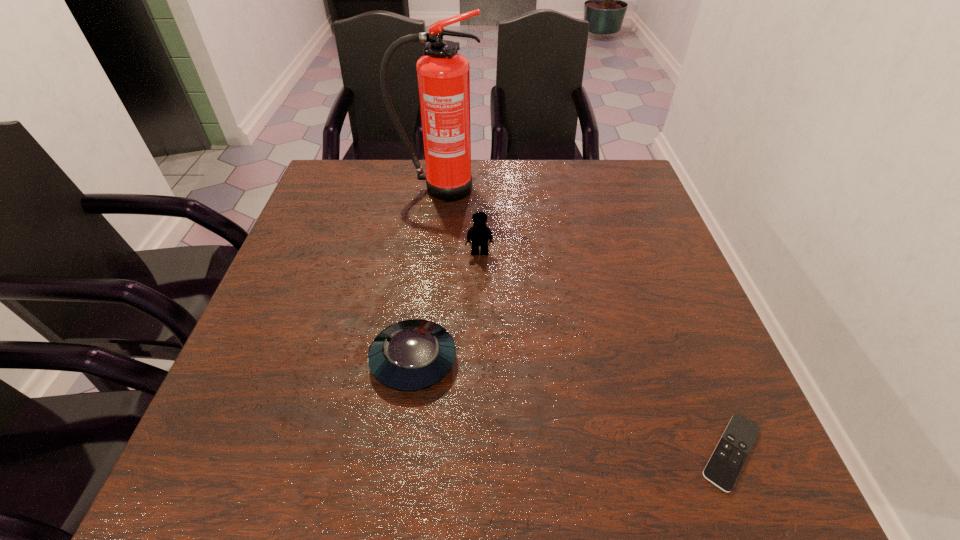
The image size is (960, 540). I want to click on the farthest object, so click(443, 75).

Where is `the tallest object`? The height and width of the screenshot is (540, 960). the tallest object is located at coordinates pos(443,75).

The width and height of the screenshot is (960, 540). In order to click on the third nearest object in this screenshot , I will do pyautogui.click(x=479, y=234).

What are the coordinates of `Lego` in the screenshot? It's located at (479, 234).

This screenshot has height=540, width=960. I want to click on saucer, so click(x=411, y=355).

The image size is (960, 540). I want to click on the third tallest object, so click(411, 355).

Where is `the nearest object`? The image size is (960, 540). the nearest object is located at coordinates (724, 466).

Locate an element on the screen. This screenshot has height=540, width=960. the shortest object is located at coordinates (724, 466).

The image size is (960, 540). What are the coordinates of `vacant region located 0.270m at the nozzle of the tallest object` in the screenshot? It's located at (429, 269).

Locate an element on the screen. This screenshot has height=540, width=960. free space located on the front-facing side of the Lego is located at coordinates click(x=480, y=306).